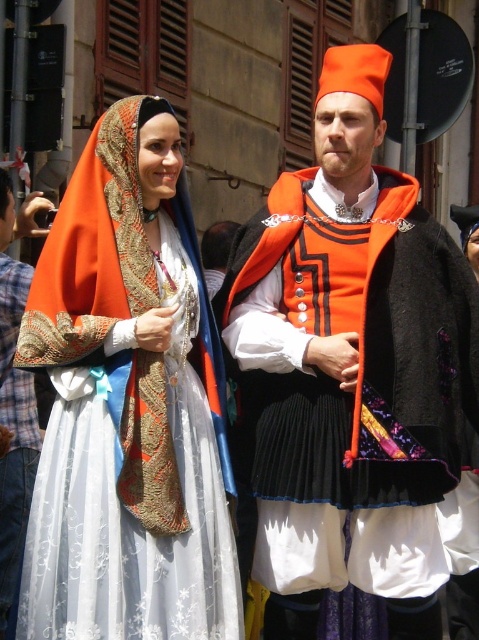
You are designing a costume for a play and need to choose between the matte orange shawl at center and the matte orange fabric at center. Which one is wider?

The matte orange shawl at center is wider than the matte orange fabric at center.

Based on the photo, you are an interior designer observing the scene. You need to place a decorative pillow between the matte orange shawl at center and the matte orange fabric at center. Which object should the pillow be closer to if it needs to be placed to the left side of the shawl?

The pillow should be placed closer to the matte orange fabric at center because the matte orange shawl at center is to the right of the matte orange fabric at center, so the fabric is on the left side of the shawl.